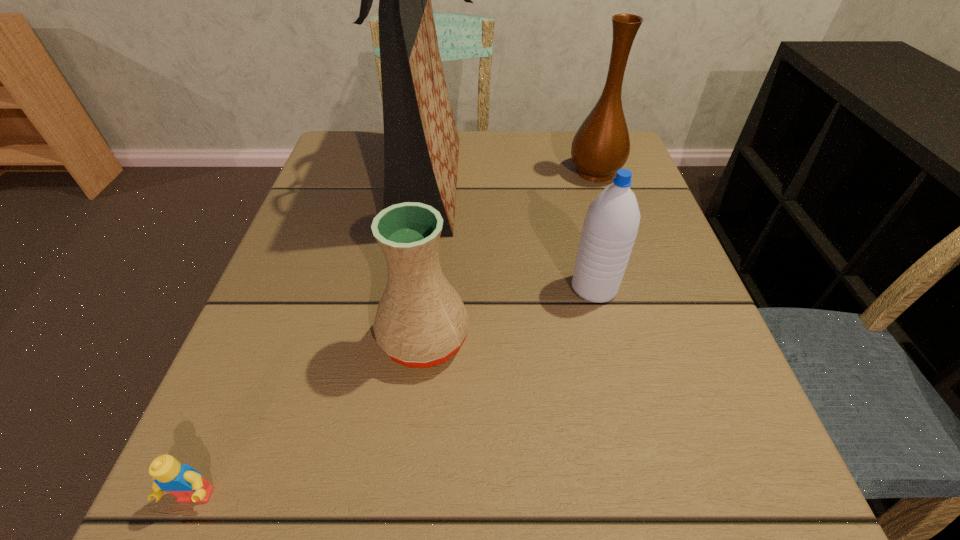
I want to click on empty space that is in between the pottery and the water bottle, so click(509, 313).

The image size is (960, 540). Identify the location of free spot between the pottery and the shortest object. 310,418.

This screenshot has width=960, height=540. I want to click on object that is the third closest to the pottery, so click(185, 483).

Where is `object that stands as the second closest to the pottery`? object that stands as the second closest to the pottery is located at coordinates (610, 227).

This screenshot has height=540, width=960. I want to click on vacant space that satisfies the following two spatial constraints: 1. on the front-facing side of the shopping bag; 2. on the left side of the water bottle, so click(x=415, y=288).

The height and width of the screenshot is (540, 960). I want to click on vacant area in the image that satisfies the following two spatial constraints: 1. on the front-facing side of the shopping bag; 2. on the front-facing side of the leftmost object, so click(386, 497).

Locate an element on the screen. Image resolution: width=960 pixels, height=540 pixels. free spot that satisfies the following two spatial constraints: 1. on the front-facing side of the tallest object; 2. on the front-facing side of the leftmost object is located at coordinates (386, 497).

Where is `free space in the image that satisfies the following two spatial constraints: 1. on the front-facing side of the shopping bag; 2. on the front-facing side of the Lego`? free space in the image that satisfies the following two spatial constraints: 1. on the front-facing side of the shopping bag; 2. on the front-facing side of the Lego is located at coordinates (386, 497).

I want to click on vacant region that satisfies the following two spatial constraints: 1. on the front-facing side of the tallest object; 2. on the front-facing side of the leftmost object, so click(386, 497).

Image resolution: width=960 pixels, height=540 pixels. Identify the location of vacant area that satisfies the following two spatial constraints: 1. on the front-facing side of the pottery; 2. on the right side of the shopping bag. (408, 339).